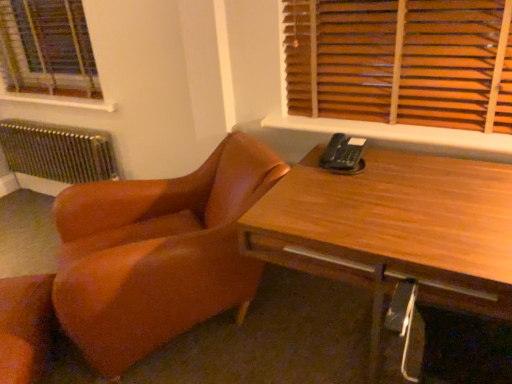
Question: From the image's perspective, is leather at lower left, the 1th chair positioned from the left, over wooden desk at center?

Choices:
 (A) yes
 (B) no

Answer: (B)

Question: Considering the relative sizes of leather at lower left, the second chair from the right, and wooden desk at center in the image provided, is leather at lower left, the second chair from the right, taller than wooden desk at center?

Choices:
 (A) yes
 (B) no

Answer: (B)

Question: Is leather at lower left, the 1th chair positioned from the left, far from wooden desk at center?

Choices:
 (A) no
 (B) yes

Answer: (B)

Question: From a real-world perspective, is leather at lower left, the 1th chair positioned from the left, physically below wooden desk at center?

Choices:
 (A) yes
 (B) no

Answer: (A)

Question: From the image's perspective, would you say leather at lower left, the second chair from the right, is shown under wooden desk at center?

Choices:
 (A) no
 (B) yes

Answer: (B)

Question: Does leather at lower left, the 1th chair positioned from the left, turn towards wooden desk at center?

Choices:
 (A) yes
 (B) no

Answer: (B)

Question: Can brown leather chair at left, positioned as the second chair in left-to-right order, be found inside wooden at upper right, the second window sill from the back?

Choices:
 (A) yes
 (B) no

Answer: (B)

Question: Considering the relative sizes of wooden at upper right, placed as the 2th window sill when sorted from top to bottom, and brown leather chair at left, positioned as the second chair in left-to-right order, in the image provided, is wooden at upper right, placed as the 2th window sill when sorted from top to bottom, taller than brown leather chair at left, positioned as the second chair in left-to-right order,?

Choices:
 (A) yes
 (B) no

Answer: (B)

Question: Is wooden at upper right, acting as the first window sill starting from the front, next to brown leather chair at left, the 1th chair from the right, and touching it?

Choices:
 (A) yes
 (B) no

Answer: (B)

Question: From a real-world perspective, does wooden at upper right, acting as the first window sill starting from the front, sit lower than brown leather chair at left, the 1th chair from the right?

Choices:
 (A) yes
 (B) no

Answer: (B)

Question: Is wooden at upper right, placed as the 2th window sill when sorted from top to bottom, far from brown leather chair at left, positioned as the second chair in left-to-right order?

Choices:
 (A) yes
 (B) no

Answer: (B)

Question: Does wooden at upper right, placed as the 2th window sill when sorted from top to bottom, have a smaller size compared to brown leather chair at left, the 1th chair from the right?

Choices:
 (A) yes
 (B) no

Answer: (A)

Question: From the image's perspective, is wooden at upper right, placed as the 2th window sill when sorted from top to bottom, beneath metallic radiator at left?

Choices:
 (A) yes
 (B) no

Answer: (B)